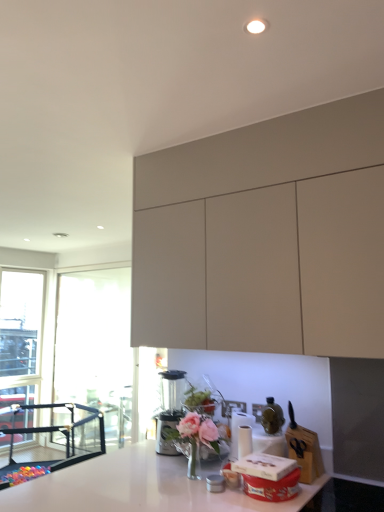
Question: Is matte white cabinets at upper center bigger than pink glass vase at center?

Choices:
 (A) yes
 (B) no

Answer: (A)

Question: Is matte white cabinets at upper center positioned in front of pink glass vase at center?

Choices:
 (A) no
 (B) yes

Answer: (B)

Question: Can you confirm if matte white cabinets at upper center is positioned to the left of pink glass vase at center?

Choices:
 (A) yes
 (B) no

Answer: (B)

Question: Is matte white cabinets at upper center shorter than pink glass vase at center?

Choices:
 (A) no
 (B) yes

Answer: (A)

Question: From a real-world perspective, is matte white cabinets at upper center located beneath pink glass vase at center?

Choices:
 (A) yes
 (B) no

Answer: (B)

Question: Can we say matte white cabinets at upper center lies outside pink glass vase at center?

Choices:
 (A) yes
 (B) no

Answer: (A)

Question: Considering the relative positions of matte white cabinets at upper center and black mesh playpen at lower left in the image provided, is matte white cabinets at upper center to the right of black mesh playpen at lower left from the viewer's perspective?

Choices:
 (A) yes
 (B) no

Answer: (A)

Question: Can you see matte white cabinets at upper center touching black mesh playpen at lower left?

Choices:
 (A) yes
 (B) no

Answer: (B)

Question: Is matte white cabinets at upper center in front of black mesh playpen at lower left?

Choices:
 (A) yes
 (B) no

Answer: (A)

Question: Does matte white cabinets at upper center have a greater height compared to black mesh playpen at lower left?

Choices:
 (A) yes
 (B) no

Answer: (A)

Question: Does matte white cabinets at upper center turn towards black mesh playpen at lower left?

Choices:
 (A) no
 (B) yes

Answer: (A)

Question: Is matte white cabinets at upper center shorter than black mesh playpen at lower left?

Choices:
 (A) yes
 (B) no

Answer: (B)

Question: Is satin silver blender at lower center turned away from pink glass vase at center?

Choices:
 (A) yes
 (B) no

Answer: (B)